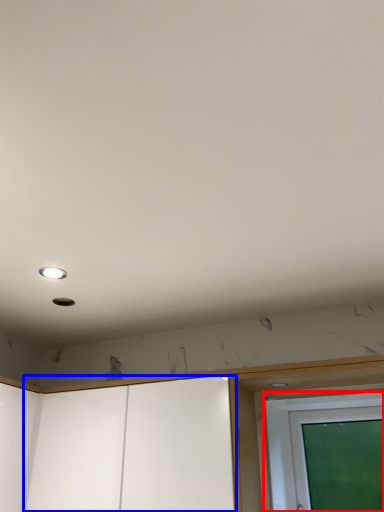
Question: Among these objects, which one is nearest to the camera, screen door (highlighted by a red box) or screen door (highlighted by a blue box)?

Choices:
 (A) screen door
 (B) screen door

Answer: (B)